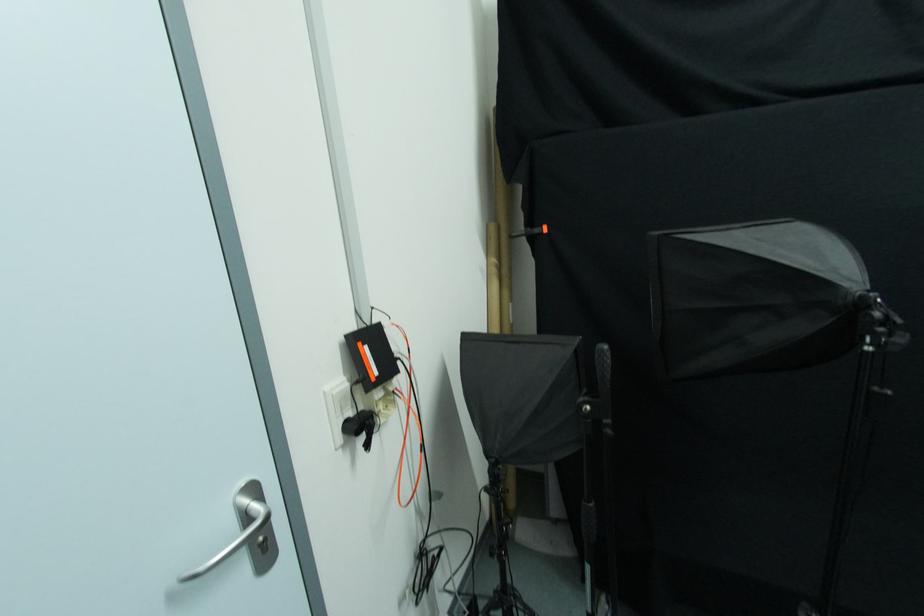
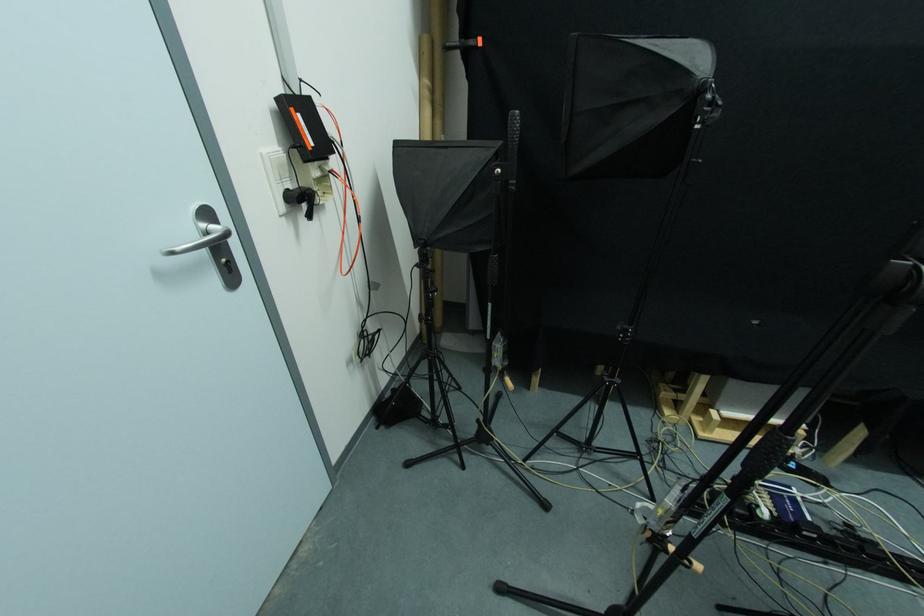
Find the pixel in the second image that matches pixel 353 416 in the first image.

(292, 188)